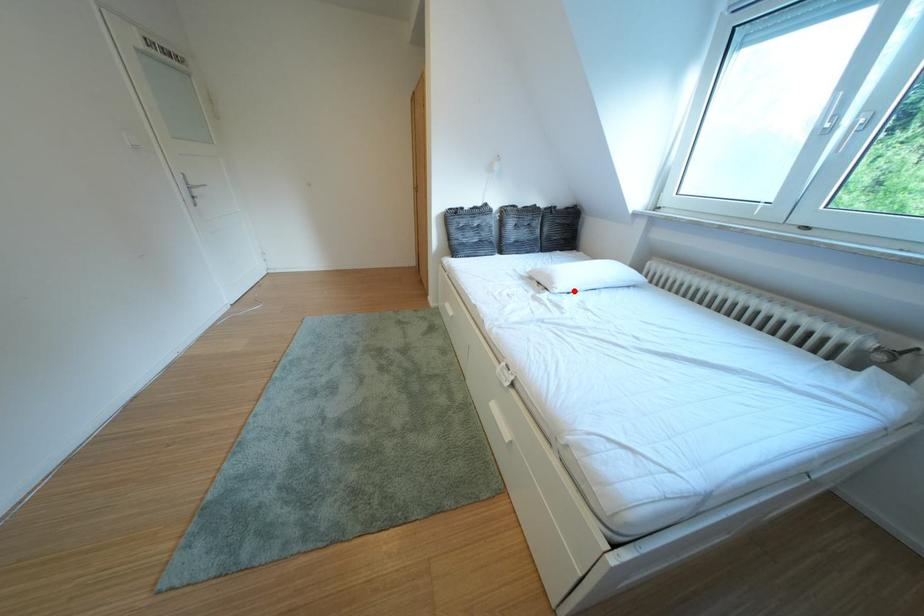
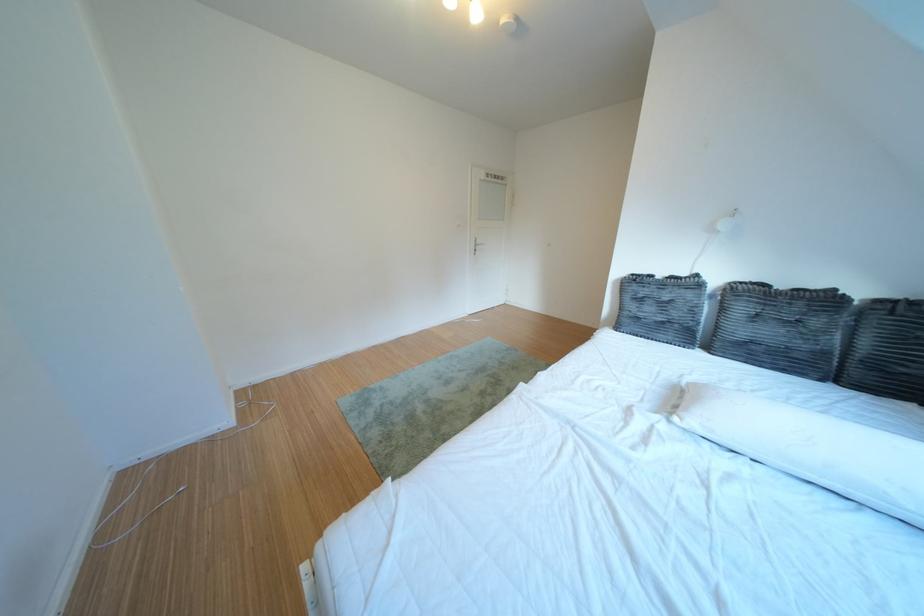
The point at the highlighted location is marked in the first image. Where is the corresponding point in the second image?

(707, 424)